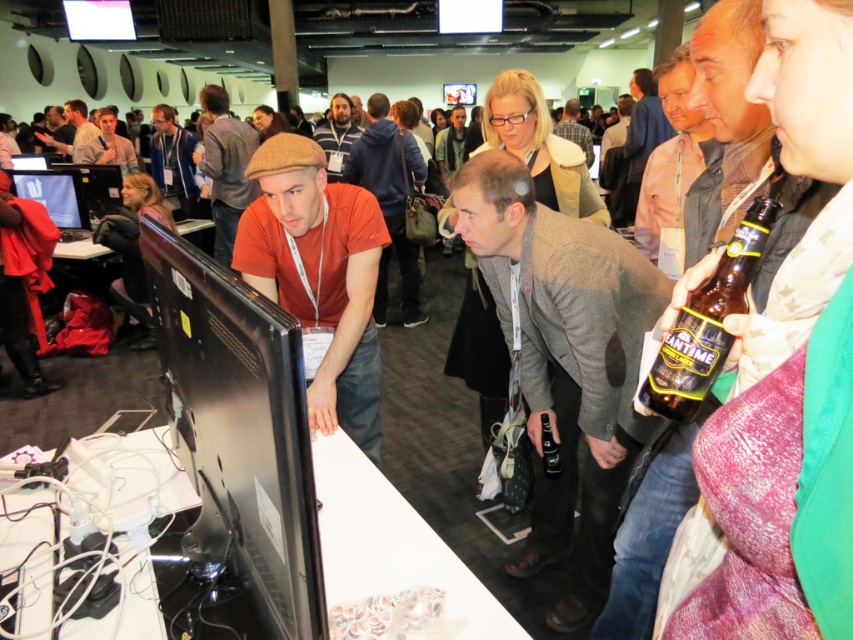
You are standing at the entrance of the conference room and see the point marked as point (53, 195). What object does this point correspond to?

The point (53, 195) corresponds to the matte black monitor at center.

You are a participant at the event and want to grab the translucent plastic bottle at center without touching the matte black monitor at center. Is this possible based on their positions?

The matte black monitor at center is above the translucent plastic bottle at center, so you can reach down to grab the translucent plastic bottle at center without touching the monitor.

You are standing in the middle of the room and want to approach the matte black monitor at center. According to the coordinates provided, in which direction should you move relative to your current position?

The matte black monitor at center is located at coordinates point (53, 195). Since you are standing in the middle of the room, you should move towards the lower left direction to reach it.